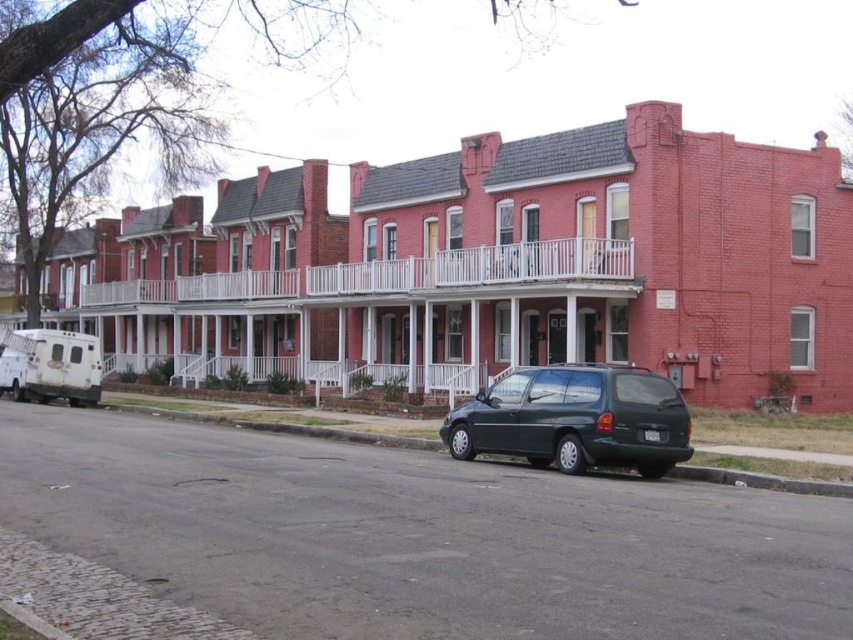
Question: Which object appears farthest from the camera in this image?

Choices:
 (A) white matte van at left
 (B) dark gray asphalt at lower center
 (C) green matte minivan at center

Answer: (A)

Question: Does white matte van at left appear on the right side of dark gray asphalt at lower center?

Choices:
 (A) yes
 (B) no

Answer: (B)

Question: Is green matte minivan at center to the left of white matte van at left from the viewer's perspective?

Choices:
 (A) yes
 (B) no

Answer: (B)

Question: Which point is farther from the camera taking this photo?

Choices:
 (A) (18, 376)
 (B) (648, 440)
 (C) (189, 419)

Answer: (A)

Question: Which of the following is the farthest from the observer?

Choices:
 (A) (532, 372)
 (B) (117, 403)
 (C) (18, 387)

Answer: (C)

Question: Does green matte minivan at center have a lesser width compared to white matte van at left?

Choices:
 (A) yes
 (B) no

Answer: (A)